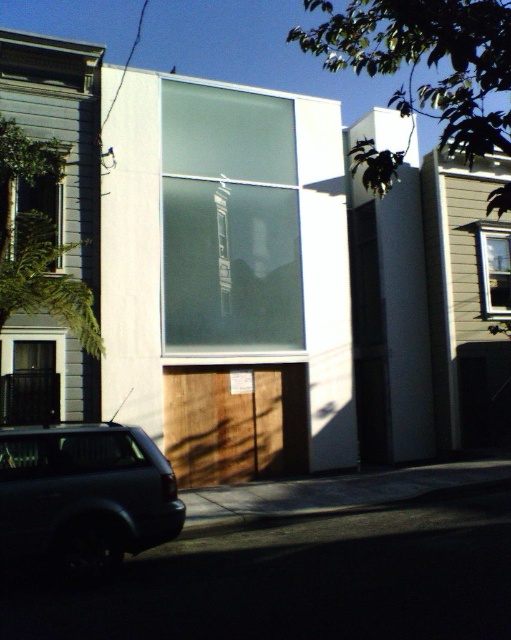
Question: In this image, where is clear glass window at left located relative to clear glass window at center?

Choices:
 (A) left
 (B) right

Answer: (A)

Question: Considering the real-world distances, which object is closest to the clear glass window at left?

Choices:
 (A) satin glass window at center
 (B) clear glass window at center
 (C) shiny black suv at lower left

Answer: (A)

Question: Is satin glass window at center wider than clear glass window at left?

Choices:
 (A) yes
 (B) no

Answer: (A)

Question: Which point is closer to the camera?

Choices:
 (A) satin glass window at center
 (B) clear glass window at center
 (C) clear glass window at left
 (D) shiny black suv at lower left

Answer: (D)

Question: Does satin glass window at center appear on the right side of clear glass window at left?

Choices:
 (A) yes
 (B) no

Answer: (A)

Question: Which point is closer to the camera?

Choices:
 (A) (58, 179)
 (B) (486, 308)
 (C) (295, 236)
 (D) (112, 424)

Answer: (D)